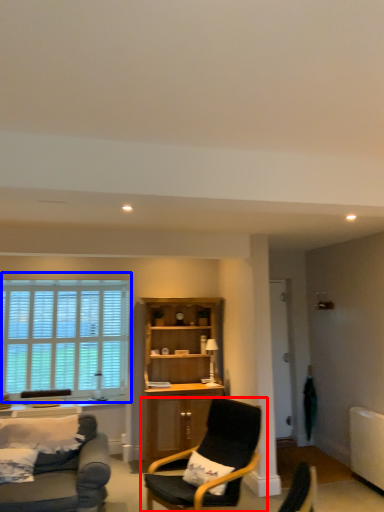
Question: Which of the following is the farthest to the observer, chair (highlighted by a red box) or window (highlighted by a blue box)?

Choices:
 (A) chair
 (B) window

Answer: (B)